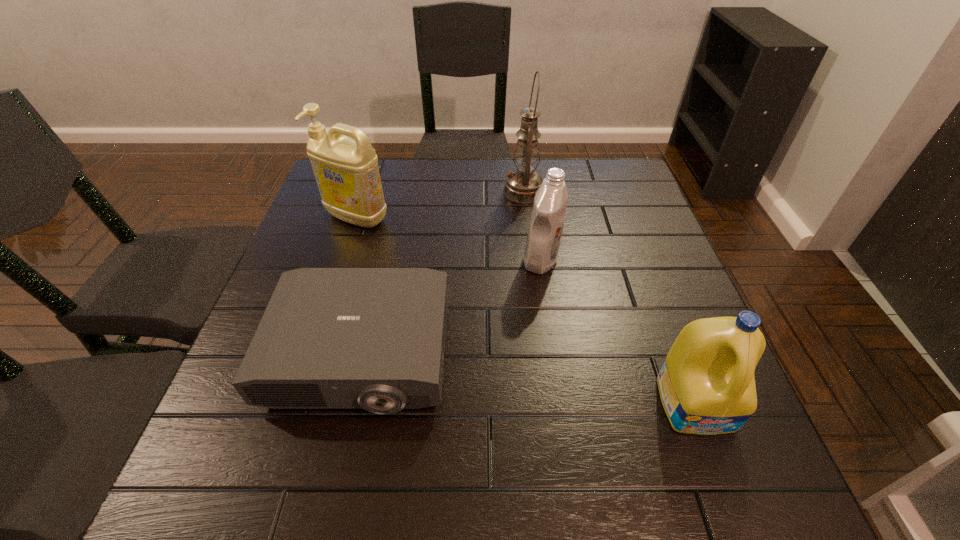
Where is `the closest object relative to the third farthest object`? the closest object relative to the third farthest object is located at coordinates (521, 185).

This screenshot has height=540, width=960. In order to click on detergent object that ranks as the second closest to the third nearest object in this screenshot , I will do `click(346, 171)`.

Find the location of a particular element. The width and height of the screenshot is (960, 540). detergent object that ranks as the second closest to the tallest detergent is located at coordinates (706, 384).

This screenshot has height=540, width=960. I want to click on vacant space that satisfies the following two spatial constraints: 1. on the front side of the third nearest object; 2. on the right side of the oil lamp, so click(533, 260).

Locate an element on the screen. This screenshot has height=540, width=960. free location that satisfies the following two spatial constraints: 1. on the back side of the oil lamp; 2. on the right side of the tallest detergent is located at coordinates (366, 191).